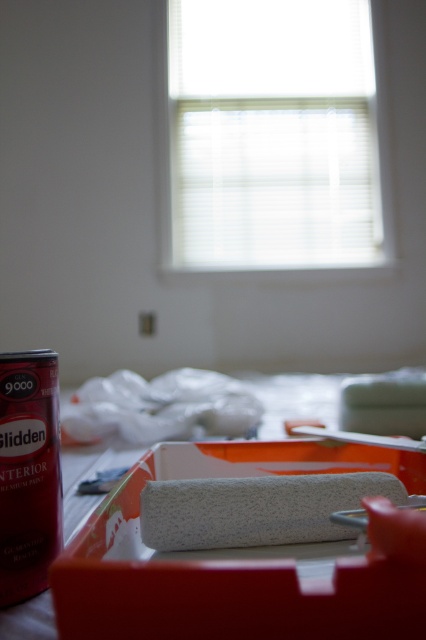
Can you confirm if white textured roller at center is taller than white textured paint roller at lower center?

Incorrect, white textured roller at center's height is not larger of white textured paint roller at lower center's.

Which is behind, point (362, 484) or point (333, 408)?

The point (333, 408) is more distant.

Is point (244, 541) in front of point (78, 454)?

Yes, it is in front of point (78, 454).

Where is `white textured roller at center`? Image resolution: width=426 pixels, height=640 pixels. white textured roller at center is located at coordinates (256, 508).